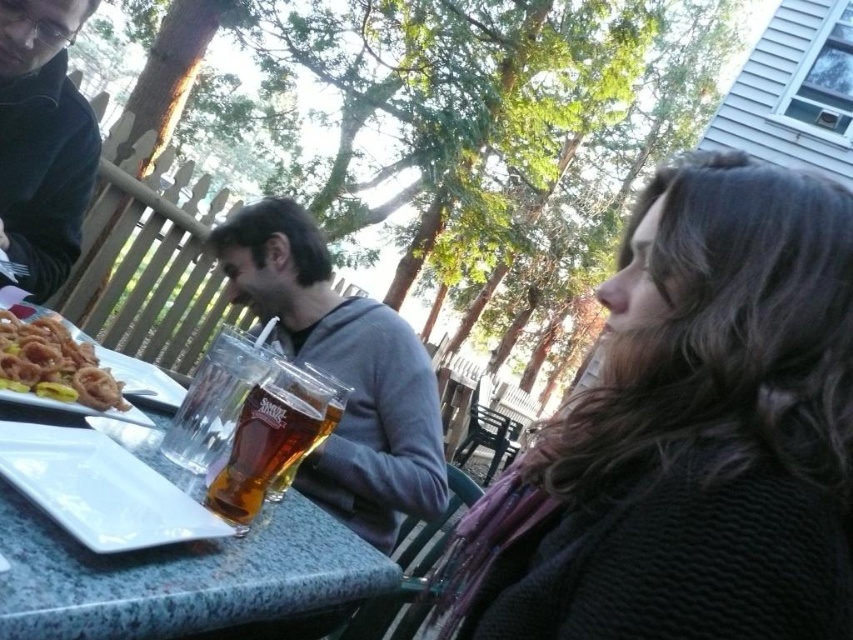
Question: Which is nearer to the golden crispy onion rings at left?

Choices:
 (A) translucent plastic cup at center
 (B) granite table at center

Answer: (B)

Question: Which point appears closest to the camera in this image?

Choices:
 (A) (281, 529)
 (B) (593, 561)
 (C) (315, 483)

Answer: (B)

Question: Observing the image, what is the correct spatial positioning of translucent plastic cup at center in reference to white glossy platter at lower left?

Choices:
 (A) below
 (B) above

Answer: (B)

Question: Does granite table at center appear on the right side of golden crispy onion rings at left?

Choices:
 (A) no
 (B) yes

Answer: (B)

Question: Which point is closer to the camera taking this photo?

Choices:
 (A) (21, 17)
 (B) (660, 609)
 (C) (44, 356)

Answer: (B)

Question: Can you confirm if translucent plastic cup at center is bigger than dark gray sweater at upper left?

Choices:
 (A) yes
 (B) no

Answer: (A)